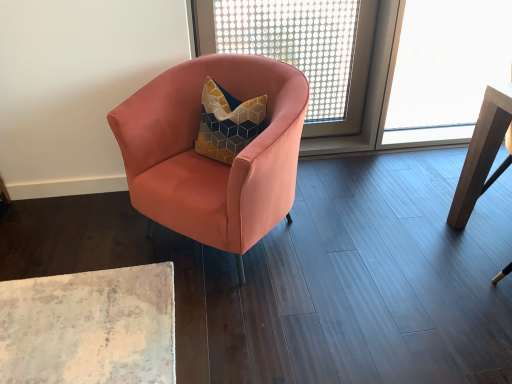
Locate an element on the screen. Image resolution: width=512 pixels, height=384 pixels. vacant space in front of matte pink armchair at center is located at coordinates (215, 319).